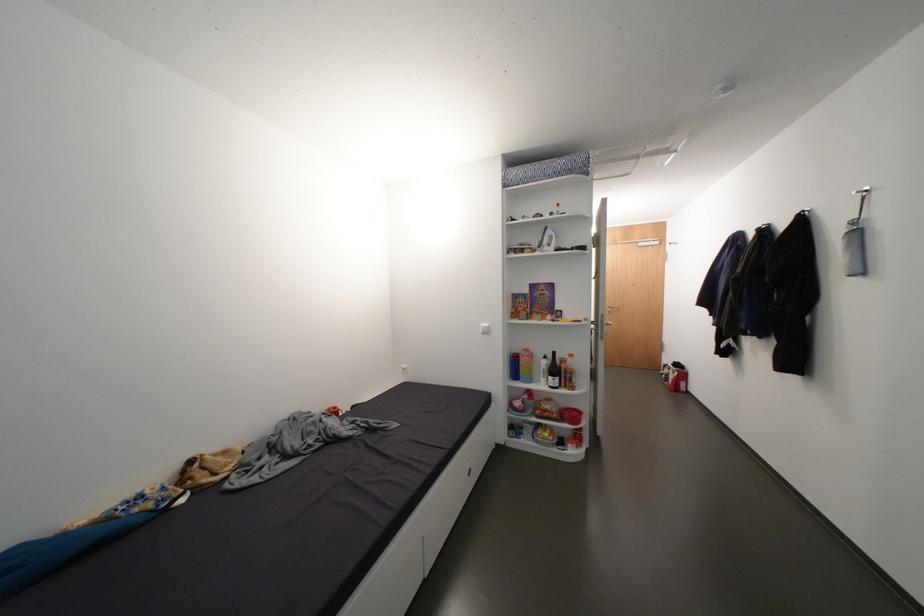
This screenshot has height=616, width=924. I want to click on recessed drawer handle, so click(x=468, y=472).